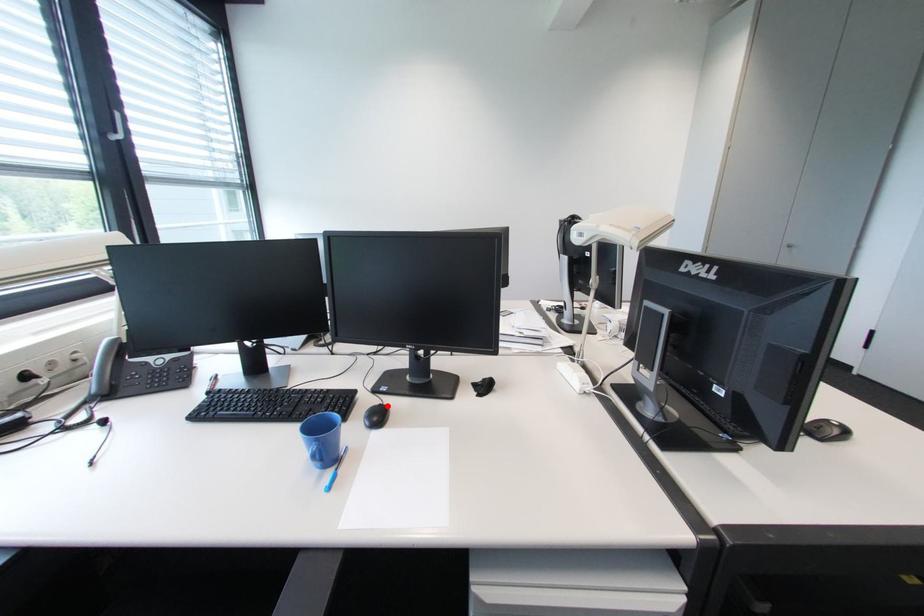
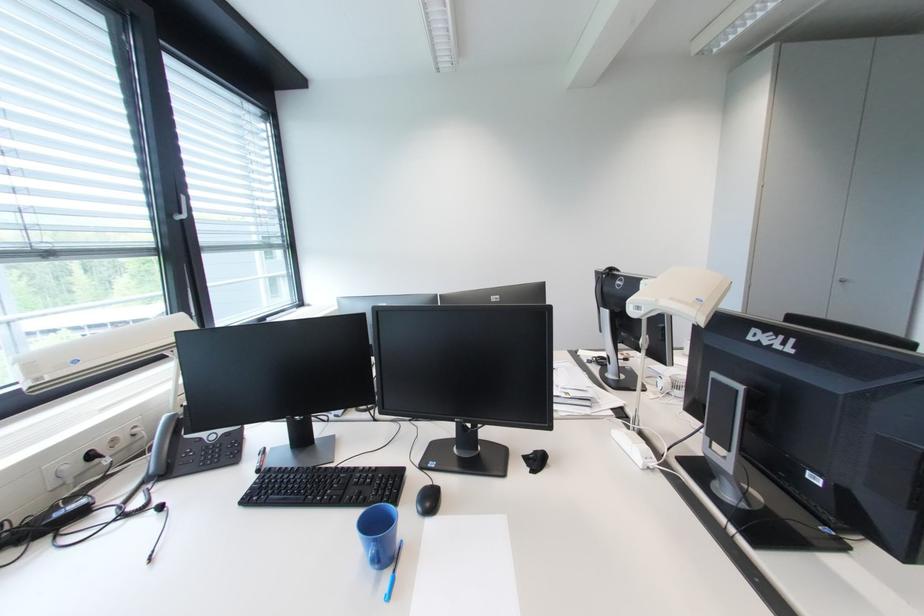
Question: I am providing you with two images of the same scene from different viewpoints. A red point is marked on the first image. Is the red point's position out of view in image 2?

Choices:
 (A) Yes
 (B) No

Answer: (B)